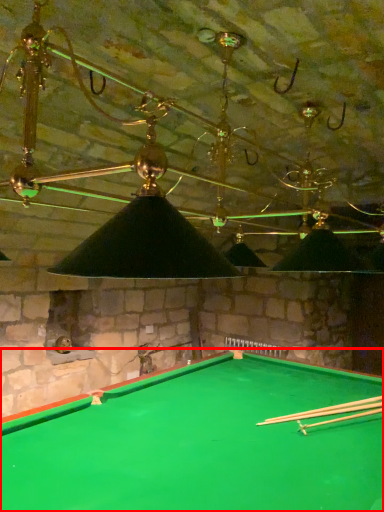
Question: From the image's perspective, what is the correct spatial relationship of billiard table (annotated by the red box) in relation to cue?

Choices:
 (A) below
 (B) above

Answer: (A)